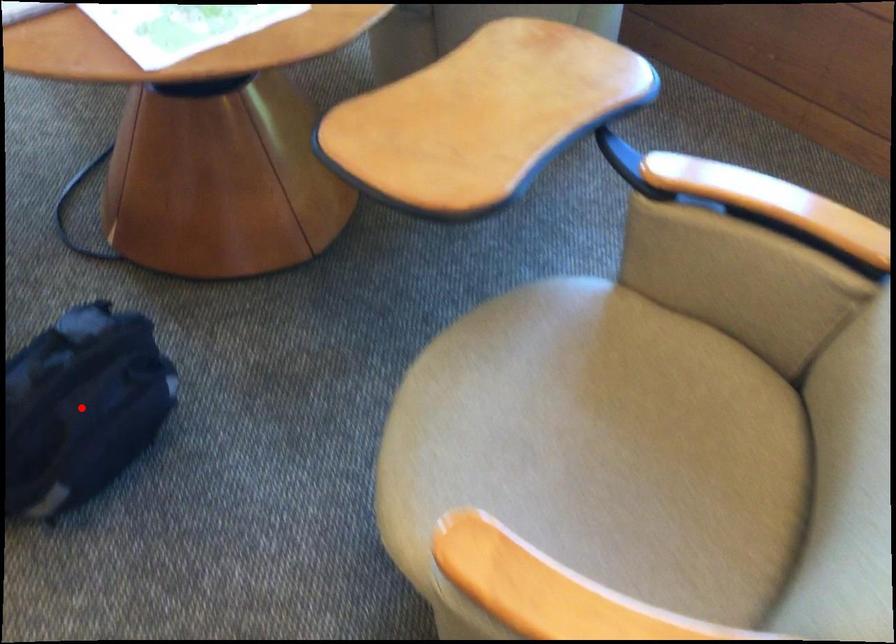
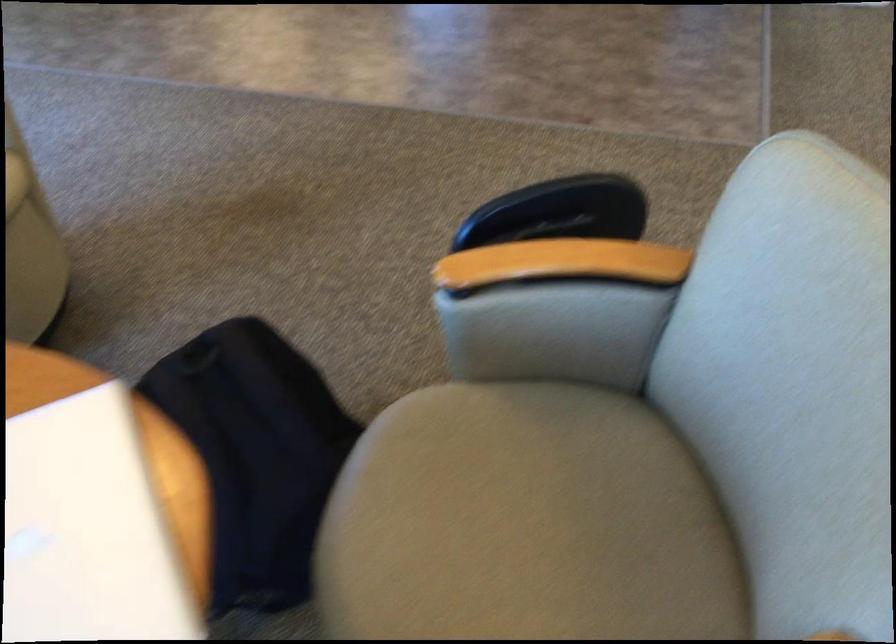
Question: I am providing you with two images of the same scene from different viewpoints. A red point is marked on the first image. Is the red point's position out of view in image 2?

Choices:
 (A) Yes
 (B) No

Answer: (A)